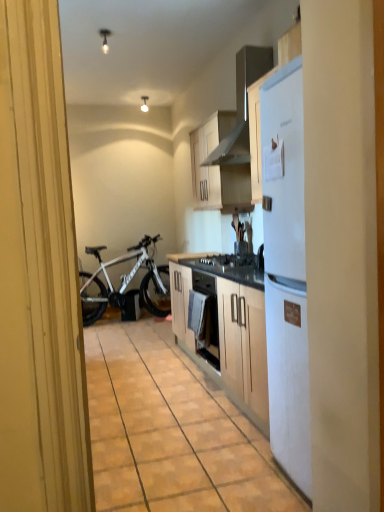
Question: From a real-world perspective, is white glossy lamp at upper center, positioned as the first lamp in back-to-front order, on matte wood floor at center?

Choices:
 (A) no
 (B) yes

Answer: (B)

Question: From the image's perspective, would you say white glossy lamp at upper center, the 1th lamp positioned from the right, is positioned over matte wood floor at center?

Choices:
 (A) no
 (B) yes

Answer: (B)

Question: Is white glossy lamp at upper center, the second lamp in the front-to-back sequence, in contact with matte wood floor at center?

Choices:
 (A) no
 (B) yes

Answer: (A)

Question: Is white glossy lamp at upper center, acting as the 2th lamp starting from the bottom, oriented towards matte wood floor at center?

Choices:
 (A) no
 (B) yes

Answer: (A)

Question: Is matte wood floor at center at the back of white glossy lamp at upper center, which ranks as the 2th lamp in left-to-right order?

Choices:
 (A) yes
 (B) no

Answer: (B)

Question: Is white matte bicycle at left situated inside white matte cabinet at upper center or outside?

Choices:
 (A) outside
 (B) inside

Answer: (A)

Question: Is white matte bicycle at left taller or shorter than white matte cabinet at upper center?

Choices:
 (A) short
 (B) tall

Answer: (B)

Question: Is point (155, 273) closer or farther from the camera than point (235, 115)?

Choices:
 (A) farther
 (B) closer

Answer: (A)

Question: Is white matte bicycle at left wider or thinner than white matte cabinet at upper center?

Choices:
 (A) thin
 (B) wide

Answer: (B)

Question: From the image's perspective, relative to white matte bicycle at left, is white glossy light bulb at upper center, placed as the first lamp when sorted from bottom to top, above or below?

Choices:
 (A) above
 (B) below

Answer: (A)

Question: In the image, is white glossy light bulb at upper center, placed as the first lamp when sorted from bottom to top, on the left side or the right side of white matte bicycle at left?

Choices:
 (A) right
 (B) left

Answer: (A)

Question: Looking at their shapes, would you say white glossy light bulb at upper center, the second lamp positioned from the right, is wider or thinner than white matte bicycle at left?

Choices:
 (A) wide
 (B) thin

Answer: (B)

Question: From a real-world perspective, is white glossy light bulb at upper center, the 1th lamp when ordered from left to right, physically located above or below white matte bicycle at left?

Choices:
 (A) below
 (B) above

Answer: (B)

Question: Looking at the image, does white matte bicycle at left seem bigger or smaller compared to white glossy lamp at upper center, positioned as the first lamp in back-to-front order?

Choices:
 (A) small
 (B) big

Answer: (B)

Question: From the image's perspective, is white matte bicycle at left positioned above or below white glossy lamp at upper center, the 1th lamp positioned from the right?

Choices:
 (A) above
 (B) below

Answer: (B)